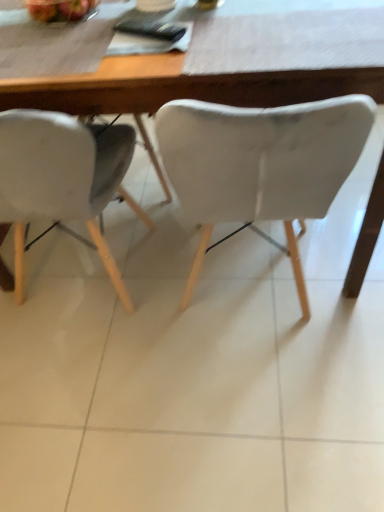
What are the coordinates of `vacant point to the right of shiny red apple at upper left` in the screenshot? It's located at (139, 4).